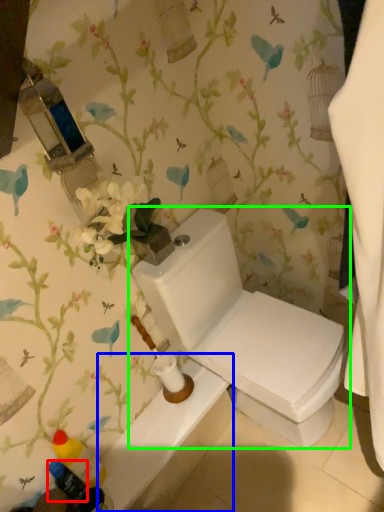
Question: Considering the real-world distances, which object is closest to toiletry (highlighted by a red box)? bath (highlighted by a blue box) or toilet (highlighted by a green box).

Choices:
 (A) bath
 (B) toilet

Answer: (A)